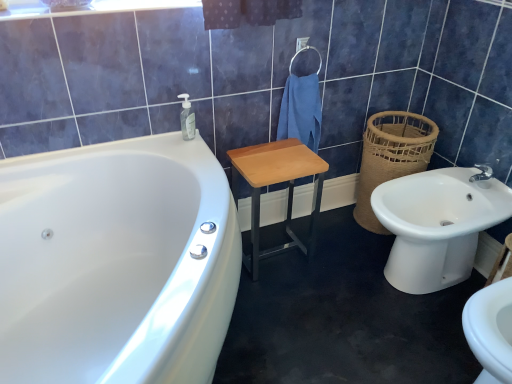
Question: In terms of width, does wooden/matte step stool at center look wider or thinner when compared to blue cotton towel at center?

Choices:
 (A) thin
 (B) wide

Answer: (B)

Question: Considering the positions of wooden/matte step stool at center and blue cotton towel at center in the image, is wooden/matte step stool at center bigger or smaller than blue cotton towel at center?

Choices:
 (A) small
 (B) big

Answer: (B)

Question: Which object is the farthest from the blue cotton towel at center?

Choices:
 (A) brown woven basket at right
 (B) white glossy bathtub at left
 (C) wooden/matte step stool at center
 (D) translucent plastic soap dispenser at upper left
 (E) white ceramic sink at right

Answer: (B)

Question: Which of these objects is positioned closest to the brown woven basket at right?

Choices:
 (A) blue cotton towel at center
 (B) translucent plastic soap dispenser at upper left
 (C) white glossy bathtub at left
 (D) white ceramic sink at right
 (E) wooden/matte step stool at center

Answer: (D)